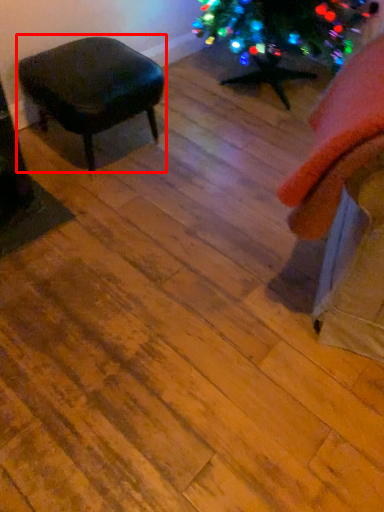
Question: From the image's perspective, where is stool (annotated by the red box) located relative to swivel chair?

Choices:
 (A) below
 (B) above

Answer: (B)